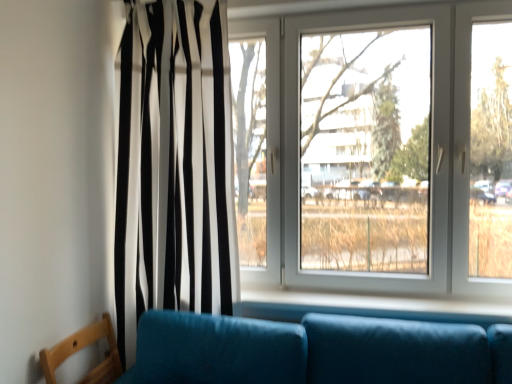
The width and height of the screenshot is (512, 384). What do you see at coordinates (386, 145) in the screenshot? I see `white plastic window at center` at bounding box center [386, 145].

Where is `black/white striped curtain at left`? The image size is (512, 384). black/white striped curtain at left is located at coordinates (174, 165).

Between wooden chair at lower left and black/white striped curtain at left, which one is positioned behind?

black/white striped curtain at left is more distant.

Is wooden chair at lower left at the right side of black/white striped curtain at left?

Incorrect, wooden chair at lower left is not on the right side of black/white striped curtain at left.

Is wooden chair at lower left smaller than black/white striped curtain at left?

Correct, wooden chair at lower left occupies less space than black/white striped curtain at left.

Which of these two, white smooth window sill at lower center or black/white striped curtain at left, is wider?

black/white striped curtain at left is wider.

Is white smooth window sill at lower center facing away from black/white striped curtain at left?

No.

Who is smaller, white smooth window sill at lower center or black/white striped curtain at left?

With smaller size is white smooth window sill at lower center.

Measure the distance from white smooth window sill at lower center to black/white striped curtain at left.

white smooth window sill at lower center and black/white striped curtain at left are 28.80 inches apart from each other.

Is black/white striped curtain at left turned away from white smooth window sill at lower center?

black/white striped curtain at left is not turned away from white smooth window sill at lower center.

From the image's perspective, is black/white striped curtain at left located beneath white smooth window sill at lower center?

No.

Does black/white striped curtain at left appear on the left side of white smooth window sill at lower center?

Indeed, black/white striped curtain at left is positioned on the left side of white smooth window sill at lower center.

Is black/white striped curtain at left touching white smooth window sill at lower center?

No, black/white striped curtain at left is not making contact with white smooth window sill at lower center.

From the image's perspective, is black/white striped curtain at left located above or below white plastic window at center?

black/white striped curtain at left is below white plastic window at center.

What are the coordinates of `window lying on the right of black/white striped curtain at left` in the screenshot? It's located at (386, 145).

Is white plastic window at center a part of black/white striped curtain at left?

That's incorrect, white plastic window at center is not inside black/white striped curtain at left.

In the image, is black/white striped curtain at left on the left side or the right side of white plastic window at center?

Based on their positions, black/white striped curtain at left is located to the left of white plastic window at center.

Is wooden chair at lower left facing away from white smooth window sill at lower center?

wooden chair at lower left does not have its back to white smooth window sill at lower center.

Considering the positions of objects wooden chair at lower left and white smooth window sill at lower center in the image provided, who is behind, wooden chair at lower left or white smooth window sill at lower center?

white smooth window sill at lower center is further from the camera.

From a real-world perspective, which is physically above, wooden chair at lower left or white smooth window sill at lower center?

From a 3D spatial view, white smooth window sill at lower center is above.

Is white smooth window sill at lower center completely or partially inside wooden chair at lower left?

No.

From the image's perspective, which one is positioned lower, white smooth window sill at lower center or wooden chair at lower left?

wooden chair at lower left.

Would you say white smooth window sill at lower center is outside wooden chair at lower left?

Yes.

What's the angular difference between white smooth window sill at lower center and wooden chair at lower left's facing directions?

white smooth window sill at lower center and wooden chair at lower left are facing 89.5 degrees away from each other.

From a real-world perspective, between white smooth window sill at lower center and wooden chair at lower left, who is vertically higher?

In real-world perspective, white smooth window sill at lower center is above.

In the image, is white smooth window sill at lower center on the left side or the right side of white plastic window at center?

Clearly, white smooth window sill at lower center is on the left of white plastic window at center in the image.

From a real-world perspective, is white smooth window sill at lower center physically located above or below white plastic window at center?

From a real-world perspective, white smooth window sill at lower center is physically below white plastic window at center.

From the image's perspective, which is above, white smooth window sill at lower center or white plastic window at center?

white plastic window at center appears higher in the image.

Is white smooth window sill at lower center further to the viewer compared to white plastic window at center?

No, it is not.

Find the location of a particular element. This screenshot has height=384, width=512. curtain above the wooden chair at lower left (from the image's perspective) is located at coordinates click(x=174, y=165).

The image size is (512, 384). Find the location of `curtain on the left side of white smooth window sill at lower center`. curtain on the left side of white smooth window sill at lower center is located at coordinates (174, 165).

Looking at the image, which one is located further to black/white striped curtain at left, wooden chair at lower left or white smooth window sill at lower center?

white smooth window sill at lower center is positioned further to the anchor black/white striped curtain at left.

Based on their spatial positions, is white plastic window at center or white smooth window sill at lower center closer to black/white striped curtain at left?

white plastic window at center is positioned closer to the anchor black/white striped curtain at left.

When comparing their distances from black/white striped curtain at left, does white smooth window sill at lower center or wooden chair at lower left seem closer?

wooden chair at lower left lies closer to black/white striped curtain at left than the other object.

Based on their spatial positions, is wooden chair at lower left or white plastic window at center further from black/white striped curtain at left?

wooden chair at lower left lies further to black/white striped curtain at left than the other object.

Which object lies further to the anchor point wooden chair at lower left, white smooth window sill at lower center or white plastic window at center?

The object further to wooden chair at lower left is white plastic window at center.

Which object lies nearer to the anchor point white smooth window sill at lower center, white plastic window at center or black/white striped curtain at left?

The object closer to white smooth window sill at lower center is white plastic window at center.

Considering their positions, is white smooth window sill at lower center positioned closer to white plastic window at center than wooden chair at lower left?

Among the two, white smooth window sill at lower center is located nearer to white plastic window at center.

From the image, which object appears to be nearer to white plastic window at center, white smooth window sill at lower center or black/white striped curtain at left?

white smooth window sill at lower center.

I want to click on curtain between wooden chair at lower left and white plastic window at center in the horizontal direction, so click(174, 165).

Find the location of a particular element. curtain between wooden chair at lower left and white smooth window sill at lower center in the horizontal direction is located at coordinates (x=174, y=165).

The height and width of the screenshot is (384, 512). Identify the location of window sill located between wooden chair at lower left and white plastic window at center in the left-right direction. (367, 306).

Where is `window sill situated between black/white striped curtain at left and white plastic window at center from left to right`? The image size is (512, 384). window sill situated between black/white striped curtain at left and white plastic window at center from left to right is located at coordinates (367, 306).